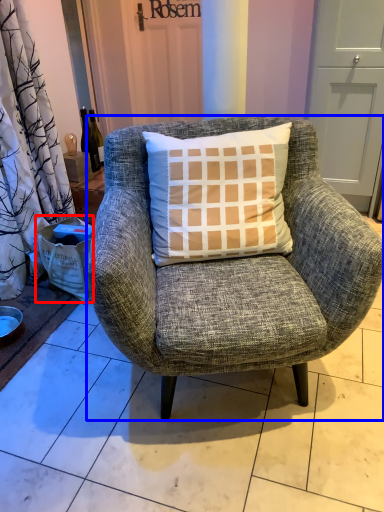
Question: Which object is closer to the camera taking this photo, box (highlighted by a red box) or chair (highlighted by a blue box)?

Choices:
 (A) box
 (B) chair

Answer: (B)